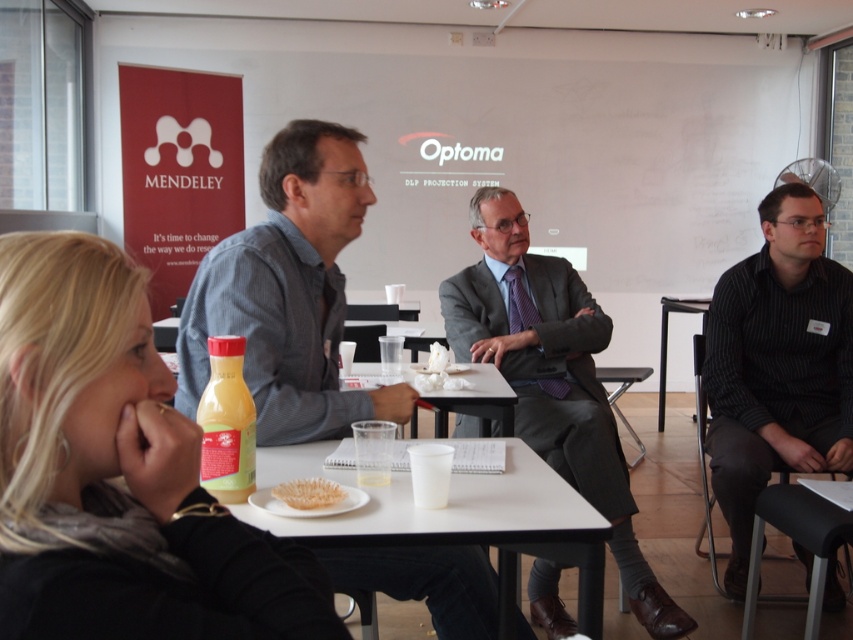
Which is more to the left, white plastic table at center or white crumpled paper at center?

white plastic table at center

Is point (491, 474) less distant than point (460, 385)?

That is True.

Find the location of a particular element. Image resolution: width=853 pixels, height=640 pixels. white plastic table at center is located at coordinates (473, 524).

Looking at this image, does blonde hair at left have a larger size compared to translucent plastic bowl at center?

Correct, blonde hair at left is larger in size than translucent plastic bowl at center.

Does blonde hair at left appear on the left side of translucent plastic bowl at center?

Indeed, blonde hair at left is positioned on the left side of translucent plastic bowl at center.

In the scene shown: Measure the distance between blonde hair at left and camera.

blonde hair at left and camera are 24.52 inches apart.

The width and height of the screenshot is (853, 640). Identify the location of blonde hair at left. (119, 474).

Does dark gray suit at center appear on the right side of white plastic table at lower center?

In fact, dark gray suit at center is to the left of white plastic table at lower center.

Is point (550, 337) more distant than point (809, 618)?

Yes, it is.

Does point (466, 289) lie in front of point (788, 493)?

No, it is behind (788, 493).

Identify the location of dark gray suit at center. (552, 378).